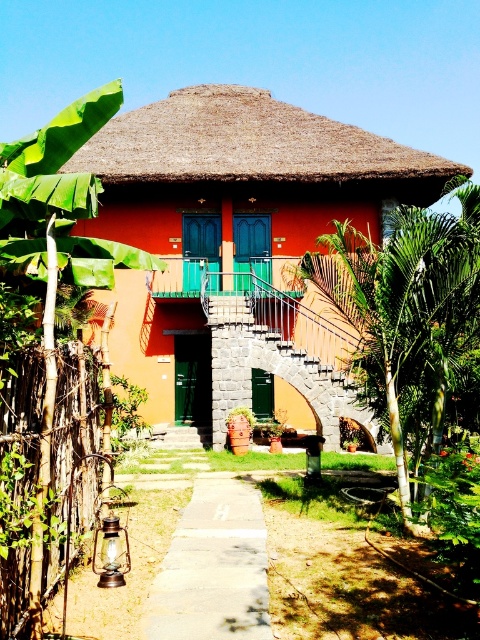
You are standing in front of the house and want to locate the green leafy tree at center. According to the coordinates provided, where would you look relative to the house?

The green leafy tree at center is located at coordinates point (406, 307), which is near the center of the image. Since the house is the main structure in the scene, the tree is positioned centrally in front of or around the house.